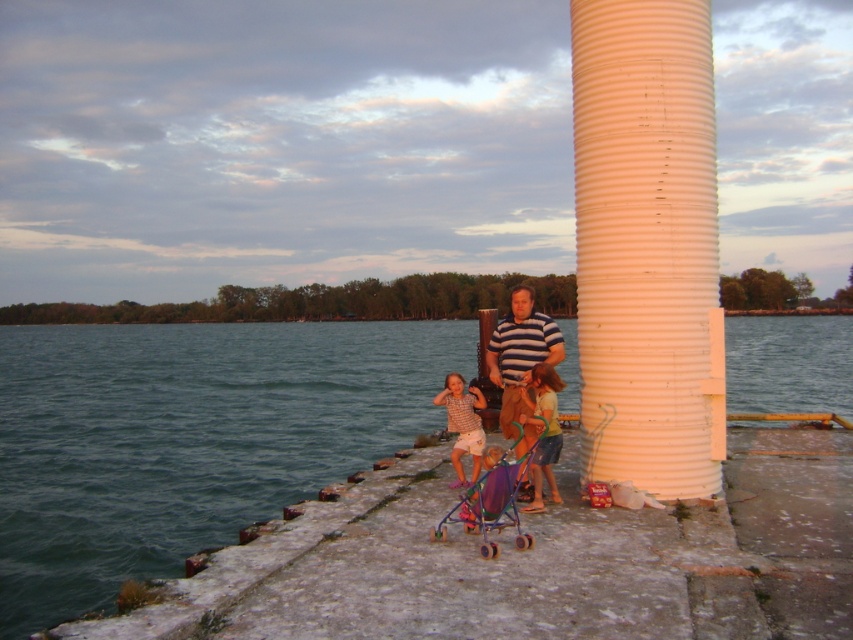
Question: Which of the following is the closest to the observer?

Choices:
 (A) green fabric shirt at lower center
 (B) metallic multicolored stroller at center
 (C) matte purple stroller at center

Answer: (B)

Question: Is striped cotton shirt at center to the right of green fabric shirt at lower center from the viewer's perspective?

Choices:
 (A) no
 (B) yes

Answer: (A)

Question: Does green water at lower left have a greater width compared to plaid shirt at center?

Choices:
 (A) yes
 (B) no

Answer: (A)

Question: In this image, where is metallic multicolored stroller at center located relative to plaid shirt at center?

Choices:
 (A) right
 (B) left

Answer: (A)

Question: Which point appears closest to the camera in this image?

Choices:
 (A) (498, 492)
 (B) (537, 349)
 (C) (549, 384)

Answer: (A)

Question: Among these objects, which one is farthest from the camera?

Choices:
 (A) green fabric shirt at lower center
 (B) white ribbed cylinder at right
 (C) green water at lower left

Answer: (B)